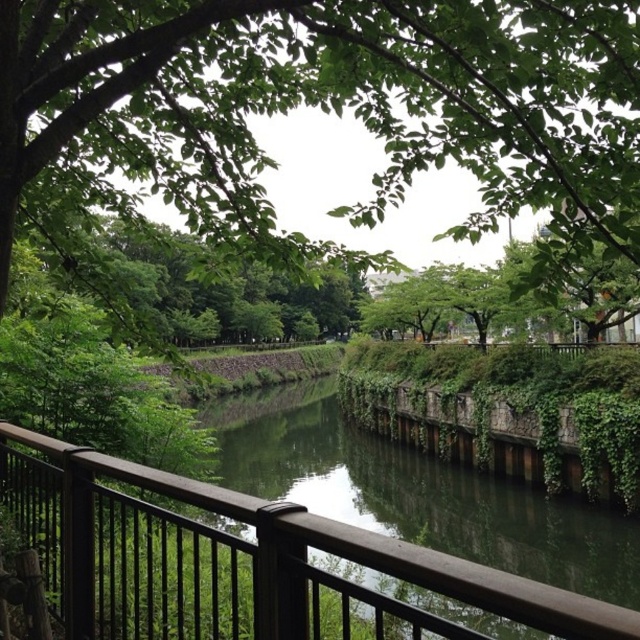
Question: Is green leafy tree at upper center below brown wooden rail at lower left?

Choices:
 (A) no
 (B) yes

Answer: (A)

Question: Among these points, which one is nearest to the camera?

Choices:
 (A) (99, 460)
 (B) (84, 3)

Answer: (B)

Question: Which point is closer to the camera taking this photo?

Choices:
 (A) (579, 33)
 (B) (580, 612)

Answer: (B)

Question: Does green leafy tree at upper center have a greater width compared to brown wooden rail at lower left?

Choices:
 (A) no
 (B) yes

Answer: (B)

Question: Is green leafy tree at upper center in front of brown wooden rail at lower left?

Choices:
 (A) no
 (B) yes

Answer: (A)